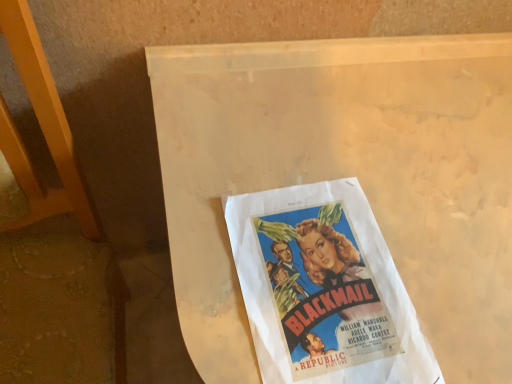
Find the location of a particular element. This screenshot has height=384, width=512. blank space situated above vintage paper poster at center (from a real-world perspective) is located at coordinates (321, 282).